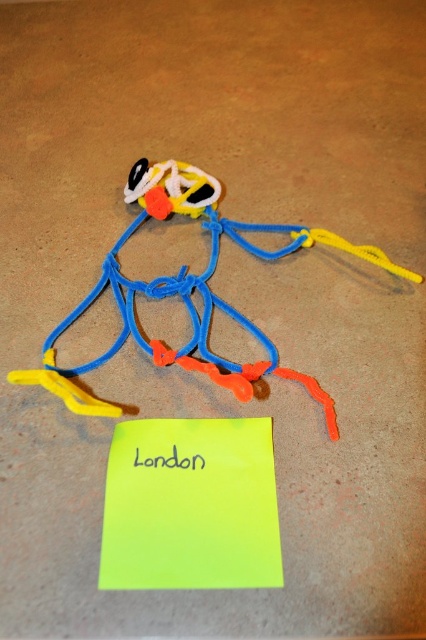
You are standing in front of the craft and the sticky note. Which of the two points, point (164, 209) or point (173, 465), is closer to you?

Point (164, 209) is closer to you because it is further to the viewer than point (173, 465).

You are an assistant who needs to place a new object at the same 2D coordinates as the flexible plastic toy at center. What coordinates should you use?

The flexible plastic toy at center is located at coordinates point (187, 292), so you should place the new object at the same coordinates point (187, 292).